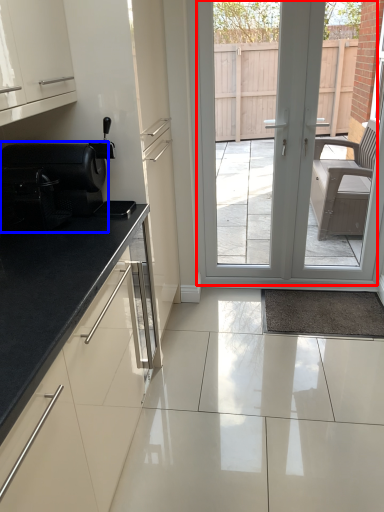
Question: Which object is closer to the camera taking this photo, door (highlighted by a red box) or appliance (highlighted by a blue box)?

Choices:
 (A) door
 (B) appliance

Answer: (B)